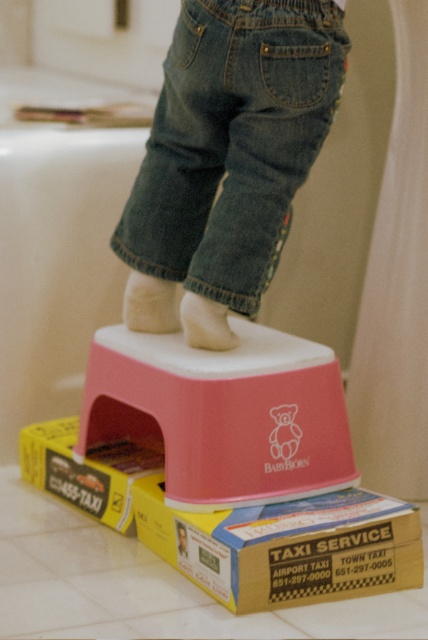
Based on the photo, who is taller, yellow cardboard box at lower center or white sock at upper center?

Standing taller between the two is yellow cardboard box at lower center.

Which of these two, yellow cardboard box at lower center or white sock at upper center, stands shorter?

white sock at upper center is shorter.

Find the location of a particular element. Image resolution: width=428 pixels, height=640 pixels. yellow cardboard box at lower center is located at coordinates (285, 547).

Can you confirm if pink plastic step stool at center is positioned to the left of white fuzzy foot at center?

In fact, pink plastic step stool at center is to the right of white fuzzy foot at center.

Is pink plastic step stool at center to the right of white fuzzy foot at center from the viewer's perspective?

Yes, pink plastic step stool at center is to the right of white fuzzy foot at center.

The width and height of the screenshot is (428, 640). What do you see at coordinates (222, 413) in the screenshot?
I see `pink plastic step stool at center` at bounding box center [222, 413].

Locate an element on the screen. pink plastic step stool at center is located at coordinates click(222, 413).

Is point (143, 276) farther from camera compared to point (199, 339)?

Yes, point (143, 276) is farther from viewer.

How distant is white fuzzy foot at center from white sock at upper center?

3.09 inches

This screenshot has width=428, height=640. Describe the element at coordinates (149, 305) in the screenshot. I see `white fuzzy foot at center` at that location.

The width and height of the screenshot is (428, 640). I want to click on white fuzzy foot at center, so click(x=149, y=305).